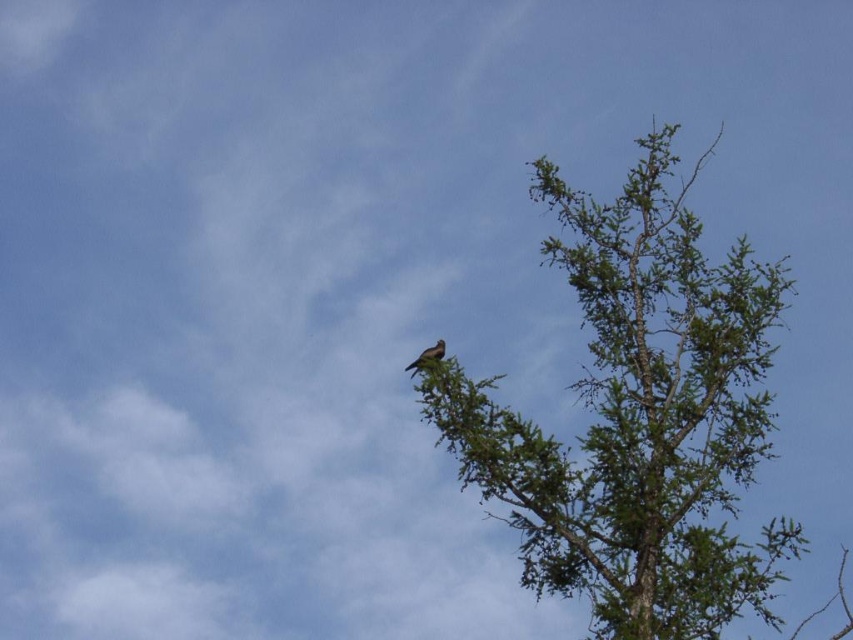
You are standing at the center of the image. Based on the coordinates provided, is the green textured tree at upper right located to your left or right side?

The green textured tree at upper right is located at coordinate point 0.655 on the x axis, which is to the right side of the image. Since you are standing at the center, the green textured tree at upper right is to your right side.

You are a birdwatcher standing in the field below the tree. You want to observe the brown feathered bird at upper center without disturbing it. Since the green textured tree at upper right is blocking your view, can you move to the left to get a better look? Explain your reasoning based on their positions.

The green textured tree at upper right is closer to the viewer than the brown feathered bird at upper center. Moving to the left might help you see around the tree, but since the tree is closer, it could still block your view depending on its size and your angle. However, since the bird is further away, adjusting your position might allow you to see it if there is an opening between the tree and your new position.

You are an ornithologist observing the green textured tree at upper right and the brown feathered bird at upper center from the ground. Which object is positioned more to the east if the tree is to the right of the bird?

The green textured tree at upper right is to the right of the brown feathered bird at upper center, so if the bird is facing north, the tree would be positioned more to the east.